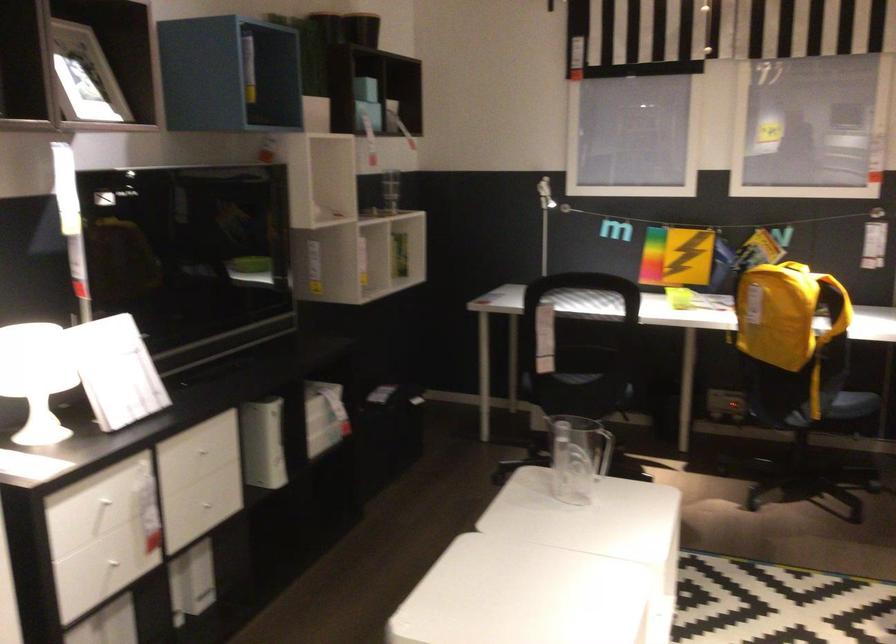
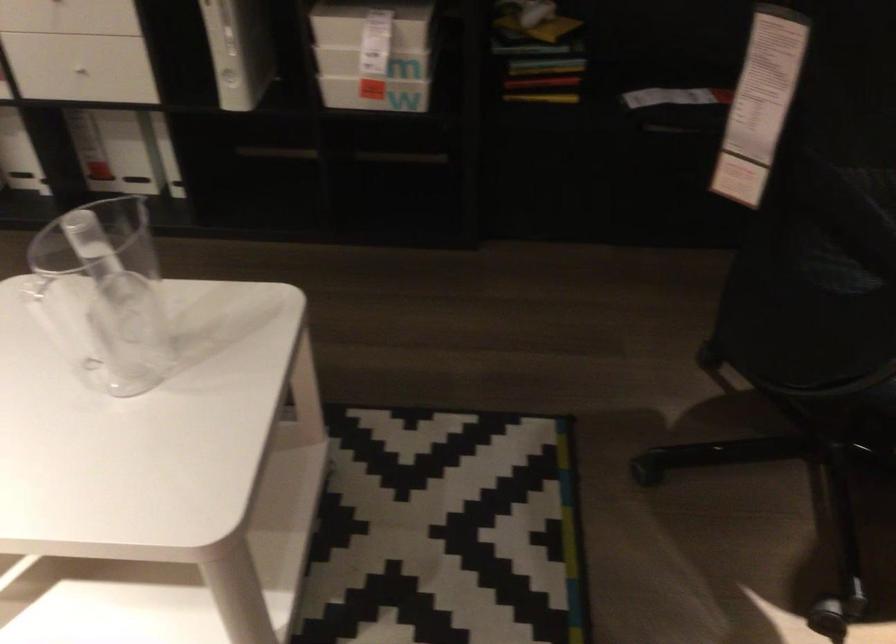
The point at (307, 406) is marked in the first image. Where is the corresponding point in the second image?

(371, 24)